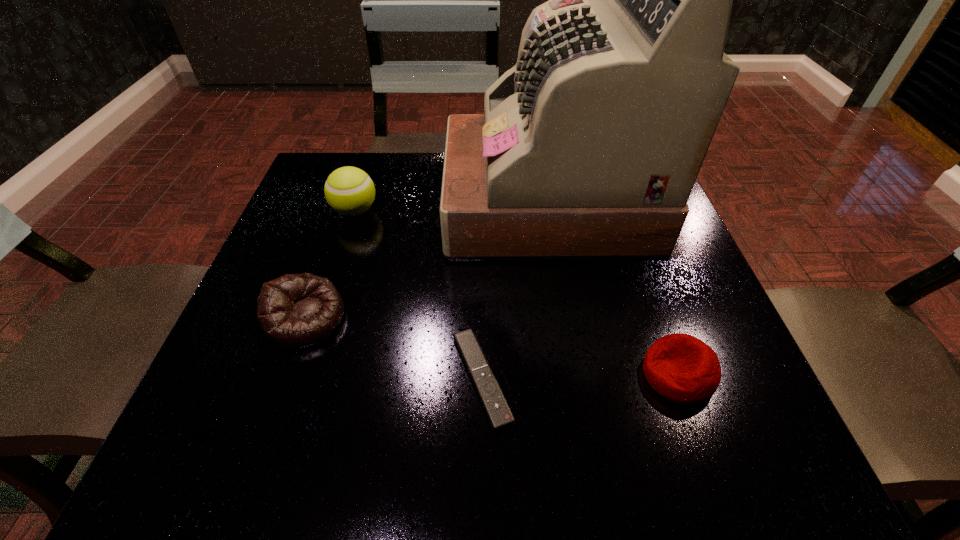
Locate an element on the screen. This screenshot has width=960, height=540. empty space between the tennis ball and the left beanbag is located at coordinates (330, 265).

Where is `free point between the right beanbag and the fourth shortest object`? This screenshot has height=540, width=960. free point between the right beanbag and the fourth shortest object is located at coordinates (516, 293).

I want to click on vacant point located between the tallest object and the left beanbag, so click(x=426, y=260).

What are the coordinates of `empty space between the shortest object and the left beanbag` in the screenshot? It's located at (394, 348).

The image size is (960, 540). In order to click on free space between the tennis ball and the right beanbag in this screenshot , I will do `click(516, 293)`.

Locate an element on the screen. The height and width of the screenshot is (540, 960). free space between the remote control and the right beanbag is located at coordinates (580, 376).

Where is `free area in between the left beanbag and the remote control`? free area in between the left beanbag and the remote control is located at coordinates (394, 348).

Select which object appears as the second closest to the remote control. Please provide its 2D coordinates. Your answer should be formatted as a tuple, i.e. [(x, y)], where the tuple contains the x and y coordinates of a point satisfying the conditions above.

[(295, 311)]

Identify which object is located as the third nearest to the right beanbag. Please provide its 2D coordinates. Your answer should be formatted as a tuple, i.e. [(x, y)], where the tuple contains the x and y coordinates of a point satisfying the conditions above.

[(295, 311)]

I want to click on free space that satisfies the following two spatial constraints: 1. on the front side of the remote control; 2. on the left side of the left beanbag, so click(285, 378).